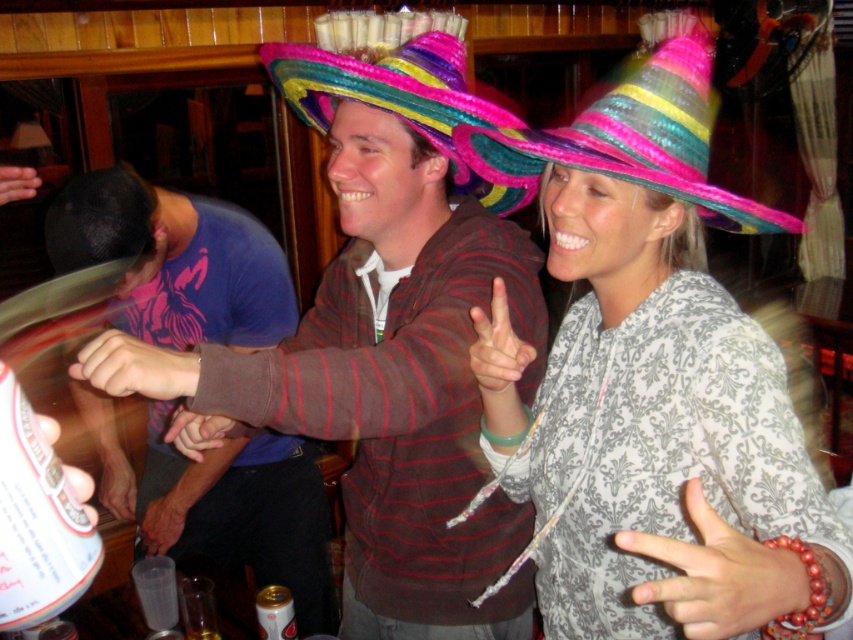
From the picture: Can you confirm if multicolored paper sombrero at center is taller than smooth plastic cup at upper left?

Yes, multicolored paper sombrero at center is taller than smooth plastic cup at upper left.

Does multicolored paper sombrero at center have a larger size compared to smooth plastic cup at upper left?

Correct, multicolored paper sombrero at center is larger in size than smooth plastic cup at upper left.

Is point (515, 115) farther from viewer compared to point (24, 170)?

Yes.

Identify the location of multicolored paper sombrero at center. The width and height of the screenshot is (853, 640). (401, 100).

Does blue t-shirt at left appear on the right side of smooth skin hand at lower left?

Correct, you'll find blue t-shirt at left to the right of smooth skin hand at lower left.

Find the location of a particular element. blue t-shirt at left is located at coordinates (175, 260).

Does point (102, 248) lie behind point (173, 536)?

No, it is not.

The height and width of the screenshot is (640, 853). In order to click on blue t-shirt at left in this screenshot , I will do `click(175, 260)`.

Based on the photo, does gold metallic can at lower center appear on the left side of smooth plastic cup at upper left?

In fact, gold metallic can at lower center is to the right of smooth plastic cup at upper left.

Between gold metallic can at lower center and smooth plastic cup at upper left, which one has less height?

smooth plastic cup at upper left is shorter.

What do you see at coordinates (276, 612) in the screenshot?
I see `gold metallic can at lower center` at bounding box center [276, 612].

Find the location of a particular element. gold metallic can at lower center is located at coordinates (276, 612).